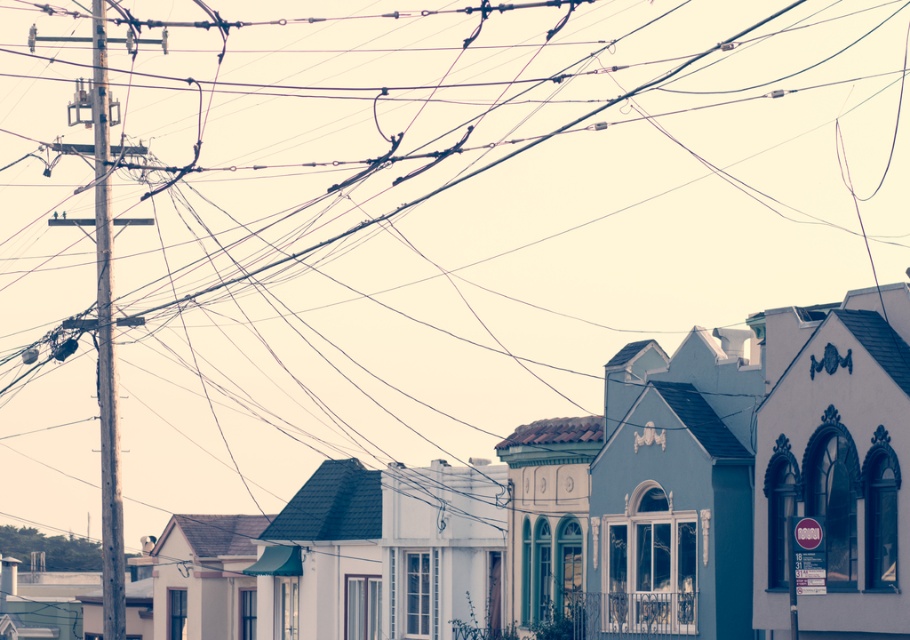
Does white matte building at center appear on the left side of wooden telegraph pole at left?

In fact, white matte building at center is to the right of wooden telegraph pole at left.

Is white matte building at center bigger than wooden telegraph pole at left?

Actually, white matte building at center might be smaller than wooden telegraph pole at left.

You are a GUI agent. You are given a task and a screenshot of the screen. Output one action in this format:
    pyautogui.click(x=<x>, y=<y>)
    Task: Click on the white matte building at center
    Image resolution: width=910 pixels, height=640 pixels.
    Given the screenshot: What is the action you would take?
    pos(728,480)